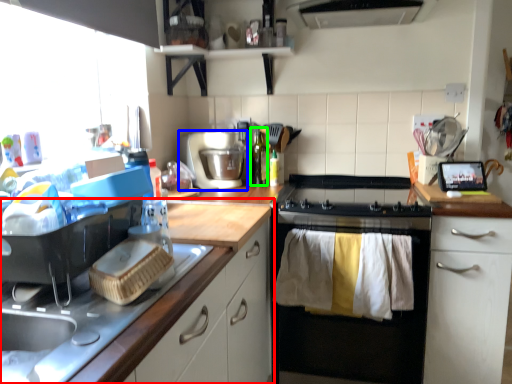
Question: Which is farther away from cabinetry (highlighted by a red box)? kitchen appliance (highlighted by a blue box) or bottle (highlighted by a green box)?

Choices:
 (A) kitchen appliance
 (B) bottle

Answer: (B)